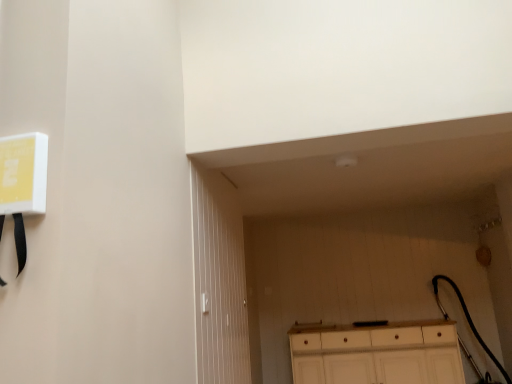
Question: From the image's perspective, does white wooden door at center appear lower than white wood cabinet at lower center?

Choices:
 (A) no
 (B) yes

Answer: (A)

Question: Is white wooden door at center further to camera compared to white wood cabinet at lower center?

Choices:
 (A) yes
 (B) no

Answer: (B)

Question: From a real-world perspective, is white wooden door at center under white wood cabinet at lower center?

Choices:
 (A) yes
 (B) no

Answer: (B)

Question: Is there a large distance between white wooden door at center and white wood cabinet at lower center?

Choices:
 (A) no
 (B) yes

Answer: (B)

Question: Is white wooden door at center turned away from white wood cabinet at lower center?

Choices:
 (A) no
 (B) yes

Answer: (A)

Question: Is white wooden door at center shorter than white wood cabinet at lower center?

Choices:
 (A) no
 (B) yes

Answer: (A)

Question: Can you confirm if white wood cabinet at lower center is taller than white wooden door at center?

Choices:
 (A) no
 (B) yes

Answer: (A)

Question: Considering the relative positions of white wood cabinet at lower center and white wooden door at center in the image provided, is white wood cabinet at lower center behind white wooden door at center?

Choices:
 (A) yes
 (B) no

Answer: (A)

Question: Does white wood cabinet at lower center appear on the right side of white wooden door at center?

Choices:
 (A) no
 (B) yes

Answer: (B)

Question: Can you confirm if white wood cabinet at lower center is bigger than white wooden door at center?

Choices:
 (A) yes
 (B) no

Answer: (A)

Question: Considering the relative positions of white wood cabinet at lower center and white wooden door at center in the image provided, is white wood cabinet at lower center to the left of white wooden door at center from the viewer's perspective?

Choices:
 (A) yes
 (B) no

Answer: (B)

Question: Is white wooden door at center at the back of white wood cabinet at lower center?

Choices:
 (A) yes
 (B) no

Answer: (B)

Question: Does point (309, 334) appear closer or farther from the camera than point (201, 377)?

Choices:
 (A) farther
 (B) closer

Answer: (A)